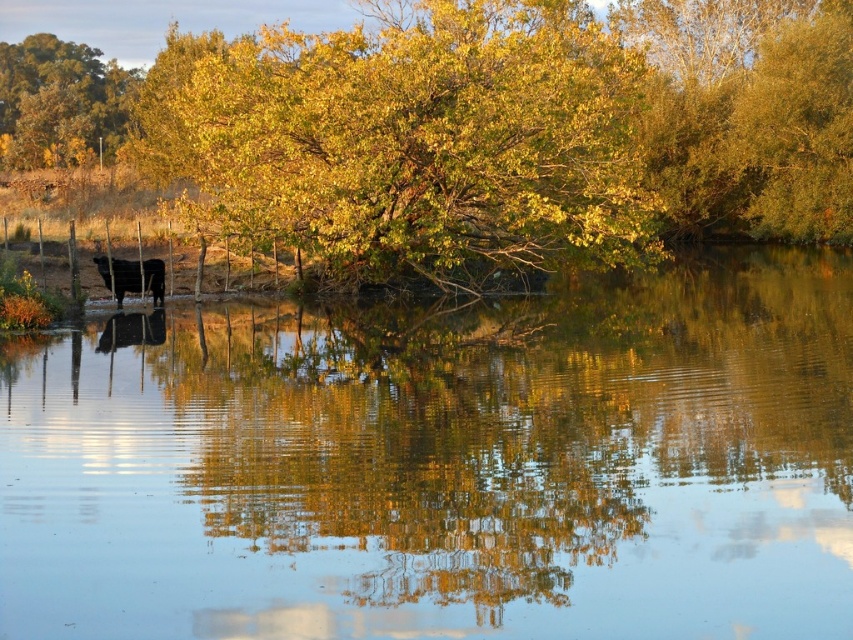
You are standing in the rural area depicted in the scene and want to take a photo of the golden leafy tree at upper left without the clear water at center appearing in the foreground. Is this possible?

The clear water at center is closer to the viewer than the golden leafy tree at upper left, so the water will block the view of the tree. Therefore, it is not possible to take a photo of the golden leafy tree at upper left without the clear water at center appearing in the foreground.

You are a photographer standing at the edge of the water. You want to capture a photo that includes both the golden leafy tree at center and the black glossy cow at left. Which object should you focus on first to ensure both are in the frame?

You should focus on the golden leafy tree at center first because it is closer to the viewer than the black glossy cow at left, so adjusting the camera to its distance will help include both in the frame.

You are a drone operator trying to capture the reflection of the trees in the clear water at center. The drone is currently at point 0.725, 0.519. Is the drone positioned correctly to capture the reflection?

Yes, the clear water at center is located at point (442,464), so the drone is correctly positioned to capture the reflection.